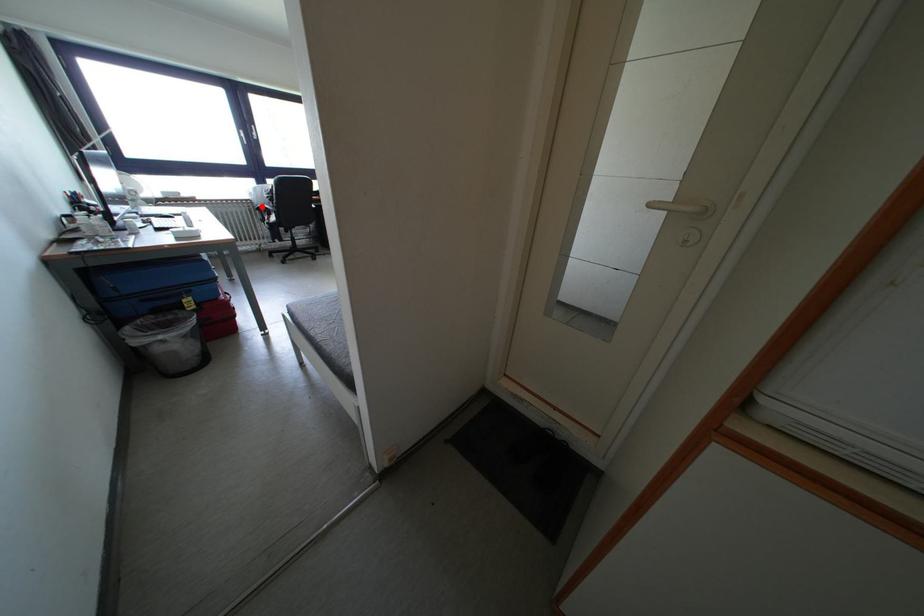
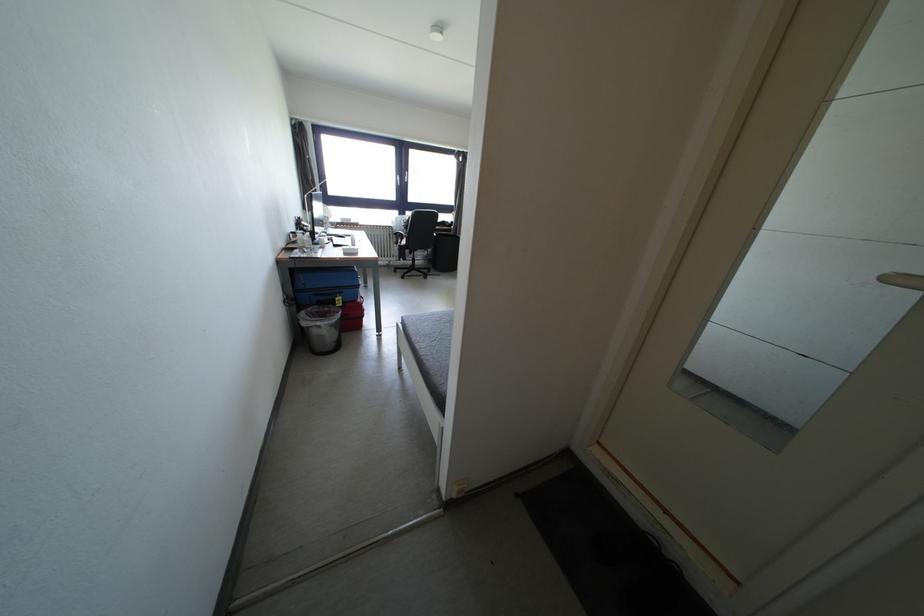
Question: I am providing you with two images of the same scene from different viewpoints. A red point is marked on the first image. At the location where the point appears in image 1, is it still visible in image 2?

Choices:
 (A) Yes
 (B) No

Answer: (A)